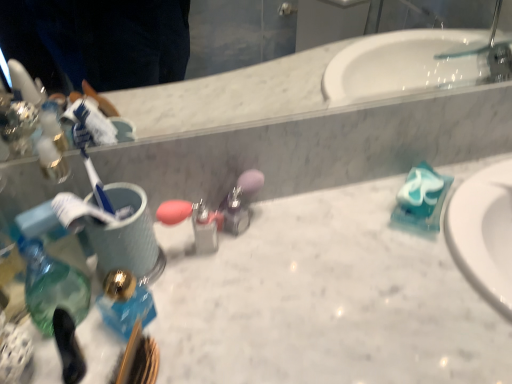
What do you see at coordinates (324, 300) in the screenshot? This screenshot has height=384, width=512. I see `white marble counter top at center` at bounding box center [324, 300].

Where is `white marble counter top at center`? The width and height of the screenshot is (512, 384). white marble counter top at center is located at coordinates (324, 300).

What is the approximate height of white marble counter top at center?

It is 36.36 inches.

Identify the location of translucent glass soap dispenser at left. (52, 286).

In order to face translucent glass soap dispenser at left, should I rotate leftwards or rightwards?

Rotate your view left by about 26.238°.

Describe the element at coordinates (52, 286) in the screenshot. I see `translucent glass soap dispenser at left` at that location.

You are a GUI agent. You are given a task and a screenshot of the screen. Output one action in this format:
    pyautogui.click(x=<x>, y=<y>)
    Task: Click on the white marble counter top at center
    This screenshot has height=384, width=512.
    Given the screenshot: What is the action you would take?
    pyautogui.click(x=324, y=300)

Is translucent glass soap dispenser at left at the left side of white marble counter top at center?

Indeed, translucent glass soap dispenser at left is positioned on the left side of white marble counter top at center.

Considering the positions of objects translucent glass soap dispenser at left and white marble counter top at center in the image provided, who is behind, translucent glass soap dispenser at left or white marble counter top at center?

translucent glass soap dispenser at left is further from the camera.

Is point (76, 322) behind point (379, 259)?

No.

From the image's perspective, is translucent glass soap dispenser at left above white marble counter top at center?

Yes, from the image's perspective, translucent glass soap dispenser at left is on top of white marble counter top at center.

From a real-world perspective, between translucent glass soap dispenser at left and white marble counter top at center, who is vertically lower?

white marble counter top at center is physically lower.

Consider the image. Is translucent glass soap dispenser at left thinner than white marble counter top at center?

Indeed, translucent glass soap dispenser at left has a lesser width compared to white marble counter top at center.

From their relative heights in the image, would you say translucent glass soap dispenser at left is taller or shorter than white marble counter top at center?

Considering their sizes, translucent glass soap dispenser at left has less height than white marble counter top at center.

Does translucent glass soap dispenser at left have a larger size compared to white marble counter top at center?

Incorrect, translucent glass soap dispenser at left is not larger than white marble counter top at center.

Is white marble counter top at center surrounded by translucent glass soap dispenser at left?

No, translucent glass soap dispenser at left does not contain white marble counter top at center.

Does translucent glass soap dispenser at left touch white marble counter top at center?

No, translucent glass soap dispenser at left is not touching white marble counter top at center.

Is translucent glass soap dispenser at left facing towards white marble counter top at center?

No, translucent glass soap dispenser at left is not turned towards white marble counter top at center.

Can you tell me how much translucent glass soap dispenser at left and white marble counter top at center differ in facing direction?

They differ by 33.8 degrees in their facing directions.

Measure the distance between translucent glass soap dispenser at left and white marble counter top at center.

translucent glass soap dispenser at left is 27.33 centimeters away from white marble counter top at center.

Where is `counter top on the right of translucent glass soap dispenser at left`? counter top on the right of translucent glass soap dispenser at left is located at coordinates (324, 300).

Between white marble counter top at center and translucent glass soap dispenser at left, which one appears on the right side from the viewer's perspective?

white marble counter top at center.

Consider the image. Which is in front, white marble counter top at center or translucent glass soap dispenser at left?

white marble counter top at center is closer to the camera.

Considering the points (444, 283) and (26, 290), which point is in front, point (444, 283) or point (26, 290)?

The point (26, 290) is closer.

From the image's perspective, is white marble counter top at center located above or below translucent glass soap dispenser at left?

Clearly, from the image's perspective, white marble counter top at center is below translucent glass soap dispenser at left.

From a real-world perspective, who is located lower, white marble counter top at center or translucent glass soap dispenser at left?

From a 3D spatial view, white marble counter top at center is below.

Between white marble counter top at center and translucent glass soap dispenser at left, which one has larger width?

Wider between the two is white marble counter top at center.

Who is taller, white marble counter top at center or translucent glass soap dispenser at left?

With more height is white marble counter top at center.

Who is smaller, white marble counter top at center or translucent glass soap dispenser at left?

With smaller size is translucent glass soap dispenser at left.

Could translucent glass soap dispenser at left be considered to be inside white marble counter top at center?

No, translucent glass soap dispenser at left is located outside of white marble counter top at center.

Is white marble counter top at center in contact with translucent glass soap dispenser at left?

No, white marble counter top at center is not beside translucent glass soap dispenser at left.

Could you tell me if white marble counter top at center is turned towards translucent glass soap dispenser at left?

No, white marble counter top at center is not turned towards translucent glass soap dispenser at left.

Can you tell me how much white marble counter top at center and translucent glass soap dispenser at left differ in facing direction?

The angle between the facing direction of white marble counter top at center and the facing direction of translucent glass soap dispenser at left is 33.8 degrees.

How much distance is there between white marble counter top at center and translucent glass soap dispenser at left?

10.76 inches.

Find the location of `counter top below the translucent glass soap dispenser at left (from a real-world perspective)`. counter top below the translucent glass soap dispenser at left (from a real-world perspective) is located at coordinates (324, 300).

The image size is (512, 384). What are the coordinates of `counter top that is under the translucent glass soap dispenser at left (from a real-world perspective)` in the screenshot? It's located at (324, 300).

I want to click on counter top to the right of translucent glass soap dispenser at left, so click(x=324, y=300).